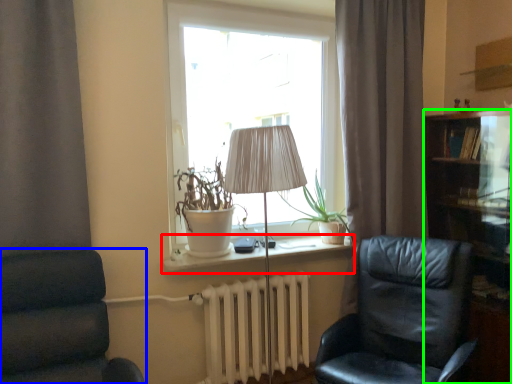
Question: Estimate the real-world distances between objects in this image. Which object is closer to window sill (highlighted by a red box), chair (highlighted by a blue box) or cabinetry (highlighted by a green box)?

Choices:
 (A) chair
 (B) cabinetry

Answer: (A)